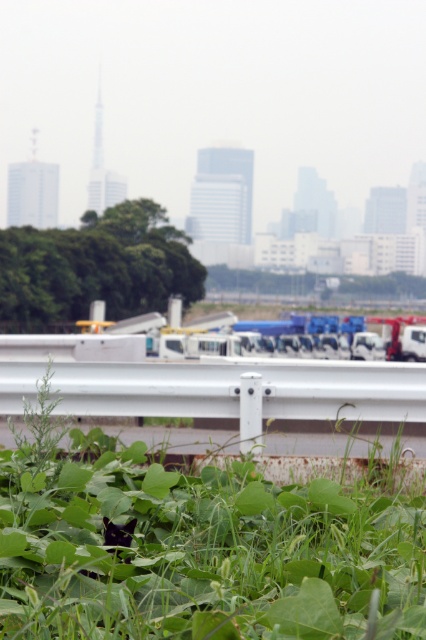
Question: Can you confirm if green leafy grass at lower center is positioned to the left of green leafy trees at center?

Choices:
 (A) yes
 (B) no

Answer: (B)

Question: Is green leafy grass at lower center smaller than green leafy trees at center?

Choices:
 (A) yes
 (B) no

Answer: (A)

Question: Which point is closer to the camera?

Choices:
 (A) green leafy trees at center
 (B) green leafy grass at lower center

Answer: (B)

Question: Is green leafy grass at lower center positioned before green leafy trees at center?

Choices:
 (A) yes
 (B) no

Answer: (A)